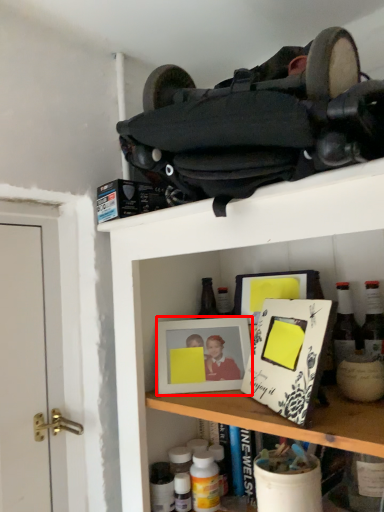
Question: From the image's perspective, what is the correct spatial positioning of picture frame (annotated by the red box) in reference to bottle?

Choices:
 (A) above
 (B) below

Answer: (A)